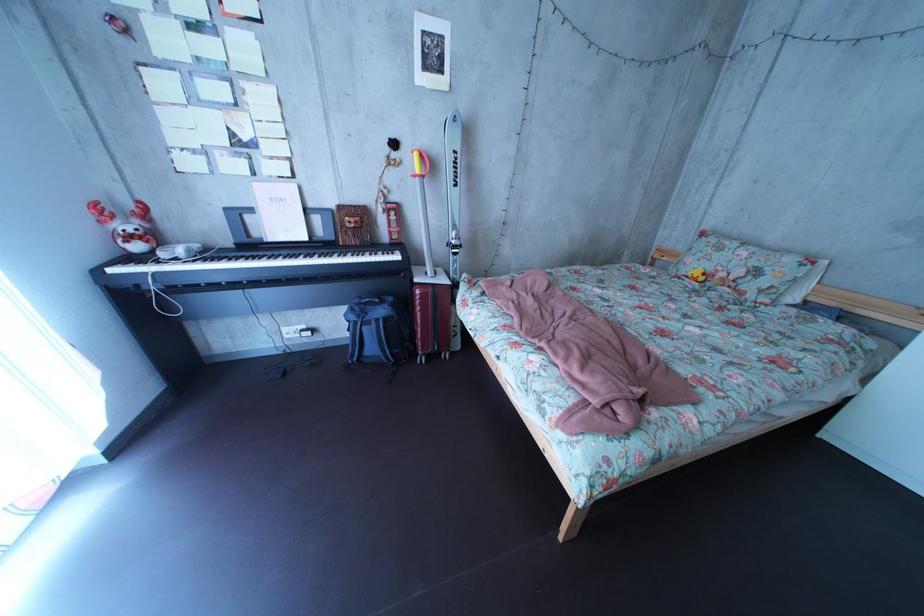
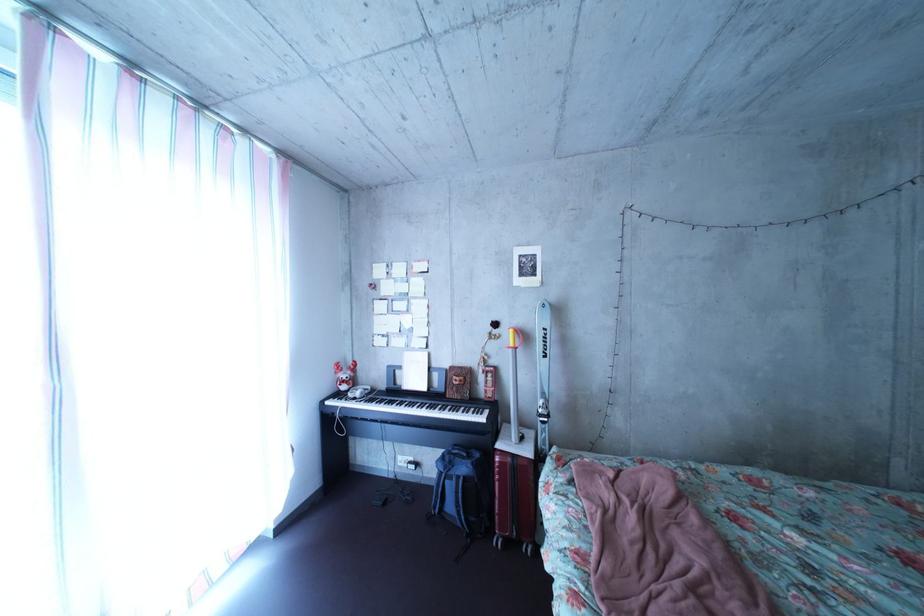
Find the pixel in the second image that matches point (152, 254) in the first image.

(358, 395)